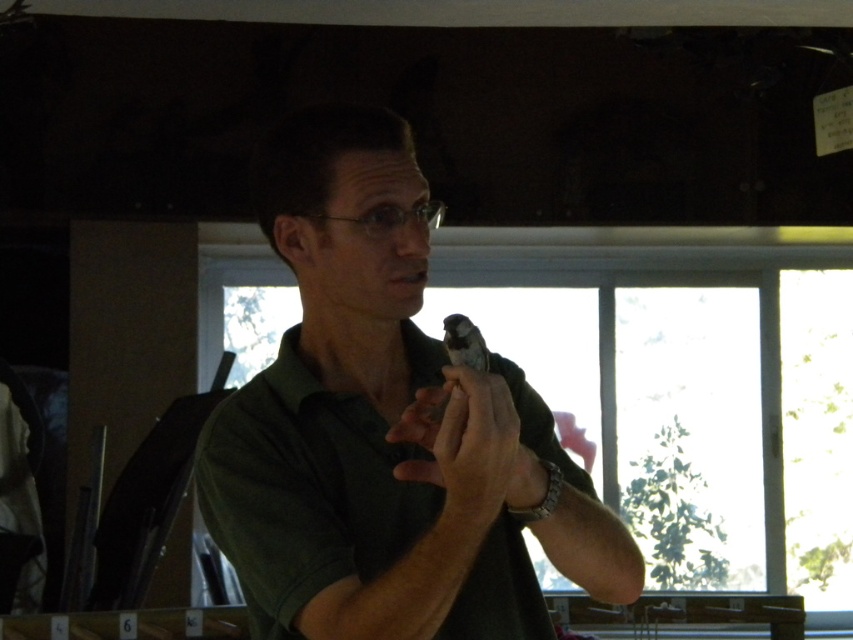
You are a photographer taking a picture of the scene. You notice the green matte shirt at center and the matte black object at center. Which one is positioned higher in the image?

The green matte shirt at center is located above the matte black object at center, so it is positioned higher in the image.

You are a photographer standing in the room where the man in the green matte shirt at center is holding a bird. You want to take a photo of the bird while ensuring the man is also in the frame. If the camera you are using has a focal length of 50mm and a sensor size of 24x36mm, what is the minimum distance you need to be from the man to include both the bird and the man in the frame without cropping?

The minimum distance required is calculated using the formula for depth of field and field of view. However, since the objects description states they are 86 centimeters apart, you need to ensure the camera can capture both within its field of view. Using the given sensor size and focal length, the horizontal field of view is approximately 39.6 degrees. The distance should be such that both the man and the bird, 86 cm apart, fit within this angle. Using trigonometry, the minimum distance is approximately 1.

You are a photographer trying to capture a closeup of the bird in the man hands. You notice the green matte shirt at center and the matte black object at center are in the background. Which background item is bigger in the photo?

The green matte shirt at center is larger in size than the matte black object at center, so the green matte shirt at center appears bigger in the photo.